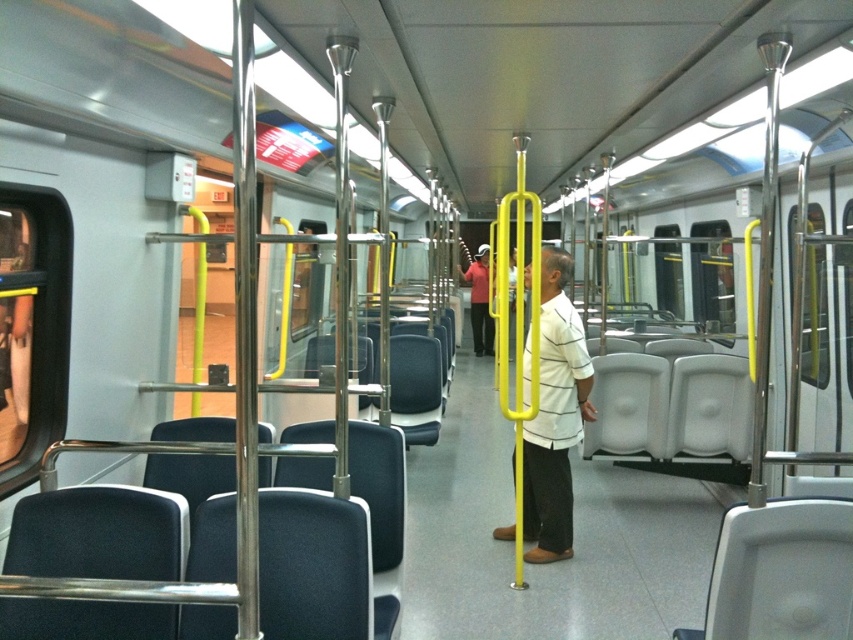
You are standing in the train car and want to reach a point closer to you. Which of the two points, point (525, 429) or point (469, 323), is closer to your current position?

Point (525, 429) is closer to the viewer than point (469, 323).